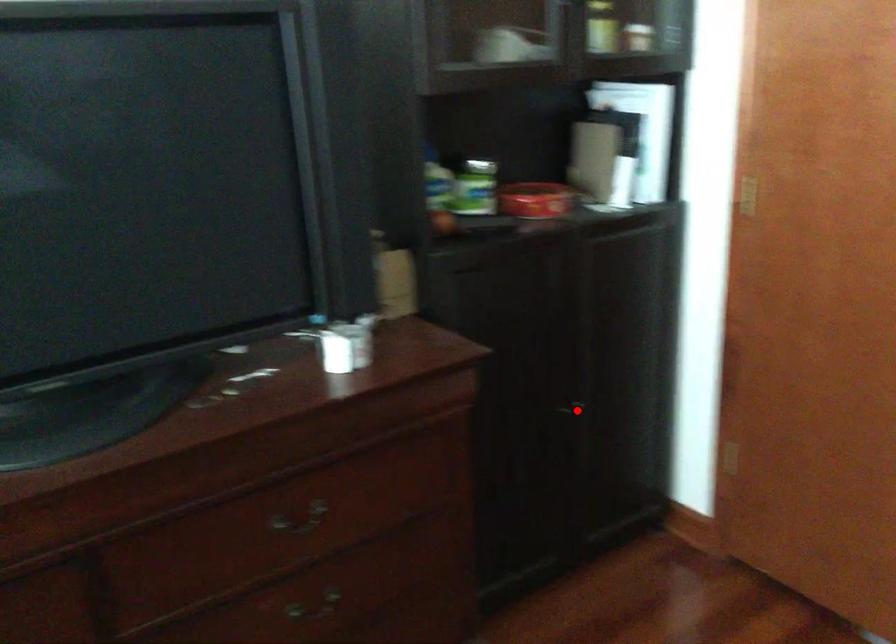
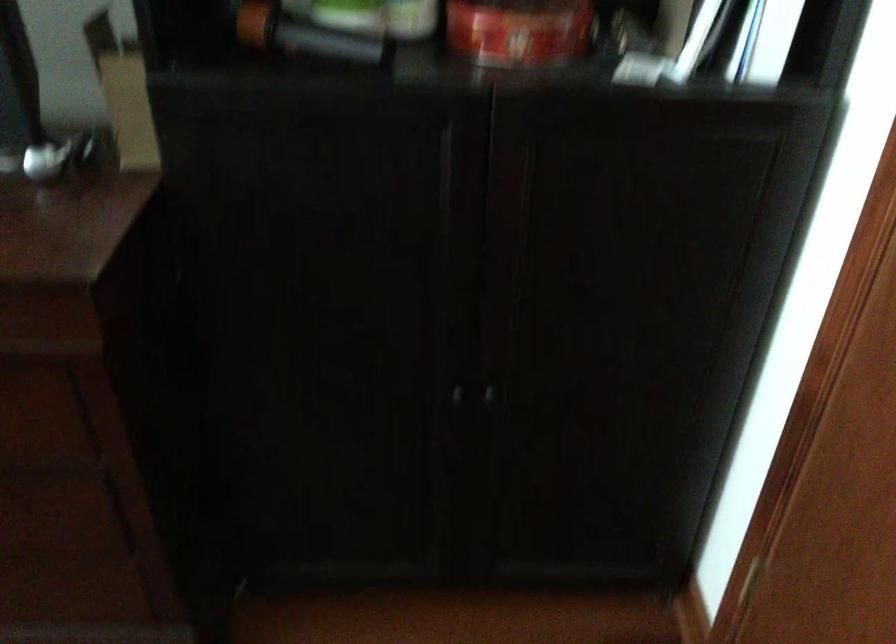
In the second image, find the point that corresponds to the highlighted location in the first image.

(487, 395)